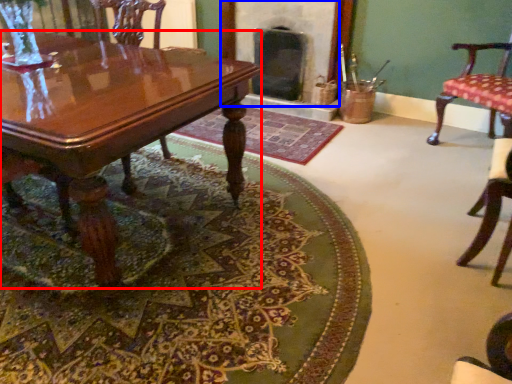
Question: Which point is further to the camera, coffee table (highlighted by a red box) or fireplace (highlighted by a blue box)?

Choices:
 (A) coffee table
 (B) fireplace

Answer: (B)